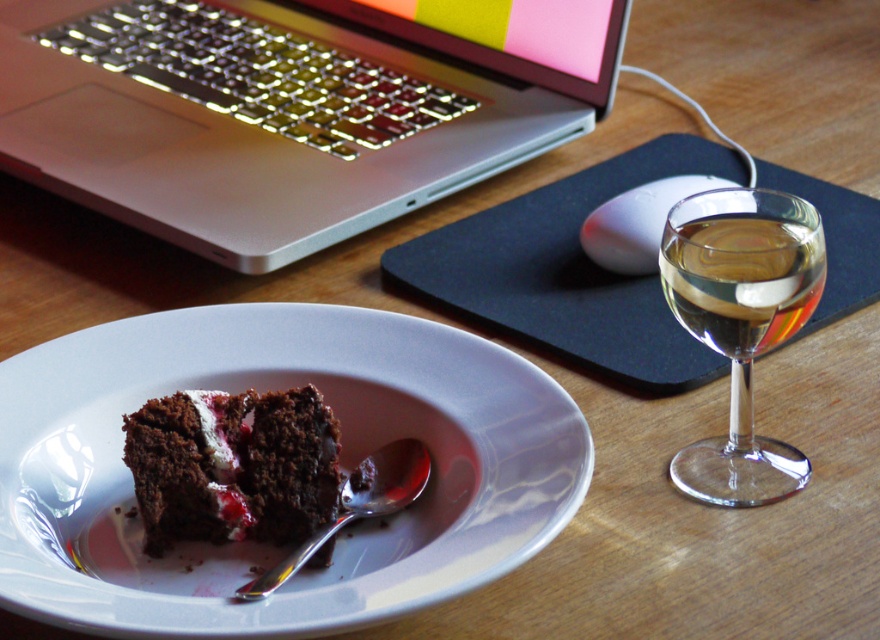
Based on the photo, you are planning to place a small decorative item between the white glossy plate at center and the transparent glass wine glass at right on the desk. Considering their sizes, which object should you place the item closer to?

You should place the decorative item closer to the transparent glass wine glass at right because the white glossy plate at center is larger in size and would require more space, making the smaller transparent glass wine glass at right a better candidate for proximity to the item.

You are organizing items on a desk and need to place a new item between the white glossy plate at center and the white matte mouse at center. Based on their current positions, which object should the new item be placed to the right of?

The new item should be placed to the right of the white glossy plate at center since it is positioned to the left of the white matte mouse at center.